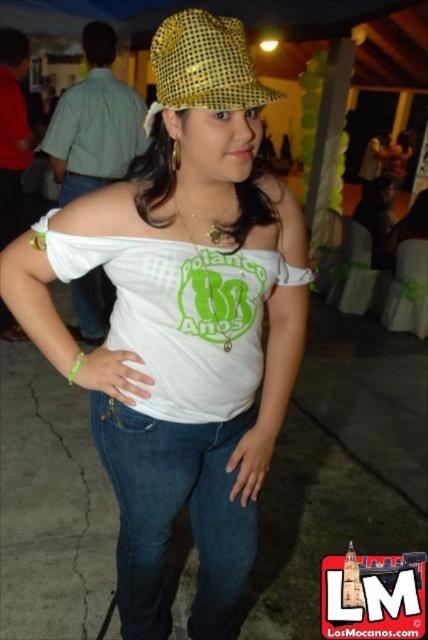
Between white matte t-shirt at center and gold sequined baseball hat at upper center, which one is positioned lower?

white matte t-shirt at center is below.

Who is shorter, white matte t-shirt at center or gold sequined baseball hat at upper center?

With less height is gold sequined baseball hat at upper center.

Between point (273, 275) and point (178, 67), which one is positioned in front?

Positioned in front is point (178, 67).

I want to click on white matte t-shirt at center, so click(181, 314).

Which is behind, point (168, 28) or point (219, 84)?

Point (168, 28)

Does matte gold hat at upper center appear on the left side of gold sequined baseball hat at upper center?

Indeed, matte gold hat at upper center is positioned on the left side of gold sequined baseball hat at upper center.

This screenshot has width=428, height=640. Describe the element at coordinates (181, 323) in the screenshot. I see `matte gold hat at upper center` at that location.

The image size is (428, 640). What are the coordinates of `matte gold hat at upper center` in the screenshot? It's located at (181, 323).

From the picture: Which is more to the left, matte gold hat at upper center or denim at left?

Positioned to the left is matte gold hat at upper center.

Does matte gold hat at upper center appear on the left side of denim at left?

Correct, you'll find matte gold hat at upper center to the left of denim at left.

Locate an element on the screen. The image size is (428, 640). matte gold hat at upper center is located at coordinates (181, 323).